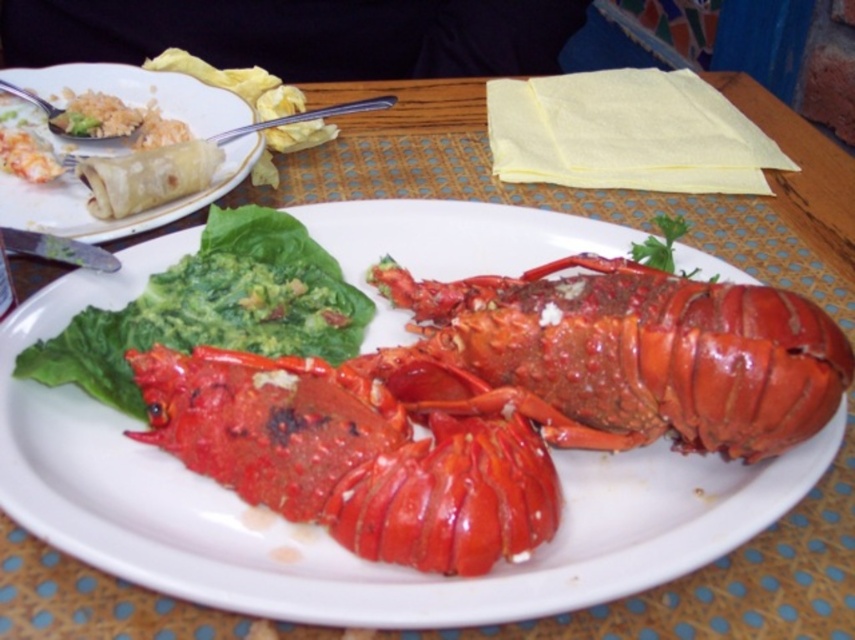
Question: Which of these objects is positioned closest to the matte tortilla at left?

Choices:
 (A) matte brown spring roll at upper left
 (B) shiny red lobster at center
 (C) green leafy at center

Answer: (A)

Question: Is green leafy at center wider than matte tortilla at left?

Choices:
 (A) no
 (B) yes

Answer: (B)

Question: Is green leafy at center behind matte brown spring roll at upper left?

Choices:
 (A) no
 (B) yes

Answer: (A)

Question: Which point is farther to the camera?

Choices:
 (A) (226, 532)
 (B) (118, 74)

Answer: (B)

Question: Based on their relative distances, which object is nearer to the matte tortilla at left?

Choices:
 (A) matte brown spring roll at upper left
 (B) green leafy at center
 (C) shiny red lobster at center

Answer: (A)

Question: Does green leafy at center have a smaller size compared to matte brown spring roll at upper left?

Choices:
 (A) yes
 (B) no

Answer: (A)